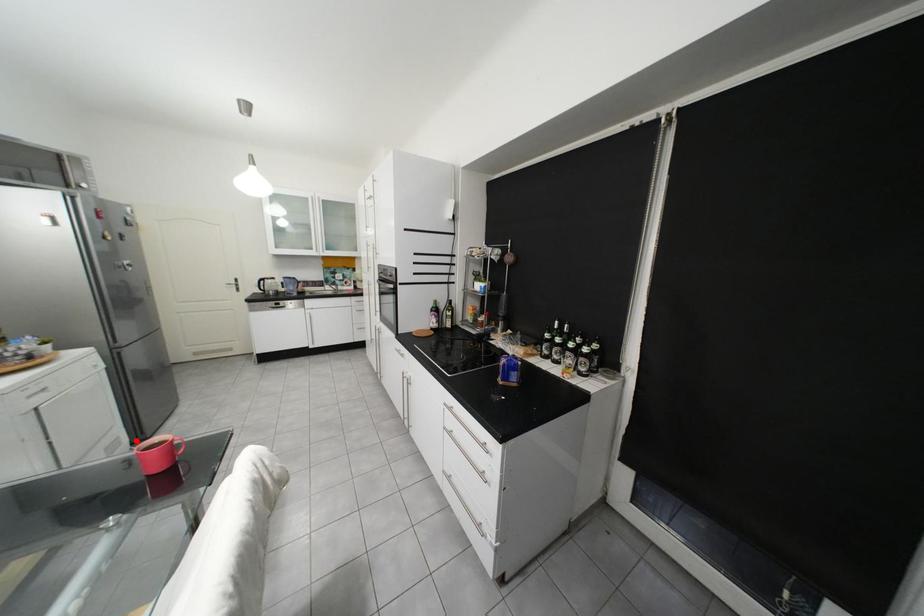
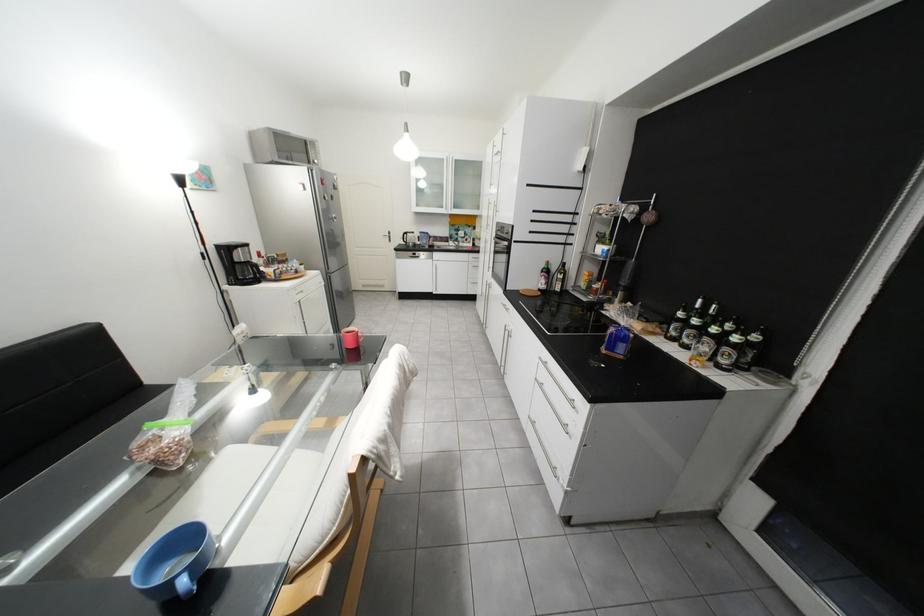
Locate, in the second image, the point that corresponds to the highlighted location in the first image.

(343, 331)